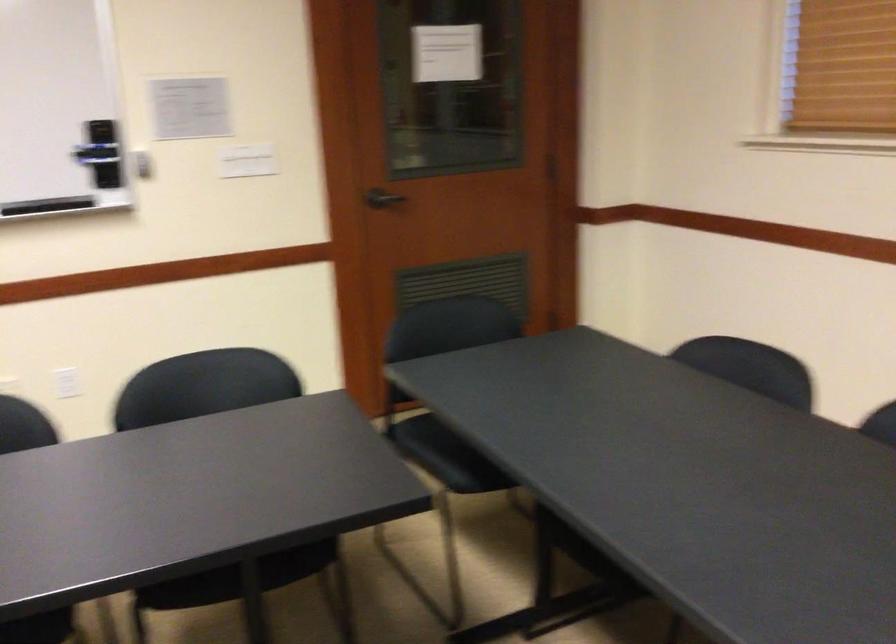
Find where to lift the black whiteboard eraser. Please return your answer as a coordinate pair (x, y).

(46, 205)